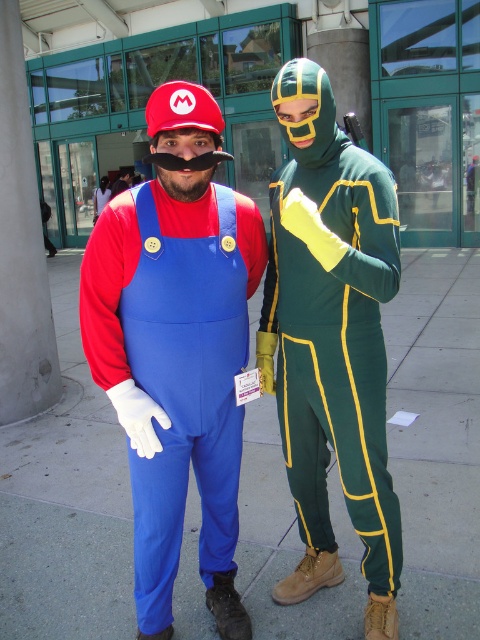
Question: Observing the image, what is the correct spatial positioning of blue fabric pants at center in reference to matte fabric mario costume at center?

Choices:
 (A) left
 (B) right

Answer: (B)

Question: Considering the relative positions of blue fabric pants at center and matte fabric mario costume at center in the image provided, where is blue fabric pants at center located with respect to matte fabric mario costume at center?

Choices:
 (A) above
 (B) below

Answer: (B)

Question: Which object appears closest to the camera in this image?

Choices:
 (A) matte fabric mario costume at center
 (B) green matte jumpsuit at center

Answer: (B)

Question: Can you confirm if blue fabric pants at center is positioned above matte fabric mario costume at center?

Choices:
 (A) no
 (B) yes

Answer: (A)

Question: Estimate the real-world distances between objects in this image. Which object is farther from the green matte jumpsuit at center?

Choices:
 (A) blue fabric pants at center
 (B) matte fabric mario costume at center

Answer: (A)

Question: Which point is farther to the camera?

Choices:
 (A) matte fabric mario costume at center
 (B) green matte jumpsuit at center
 (C) blue fabric pants at center

Answer: (C)